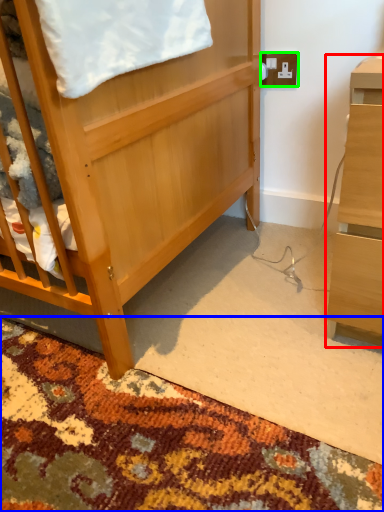
Question: Considering the real-world distances, which object is closest to desk (highlighted by a red box)? mat (highlighted by a blue box) or electric outlet (highlighted by a green box).

Choices:
 (A) mat
 (B) electric outlet

Answer: (A)